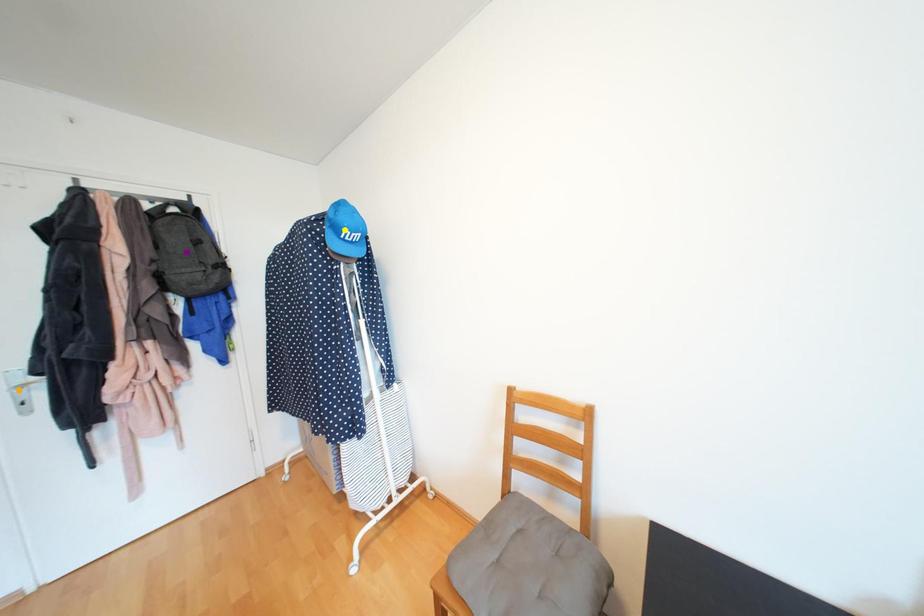
Order these from nearest to farthest:
A) orange point
B) yellow point
C) purple point

orange point
yellow point
purple point